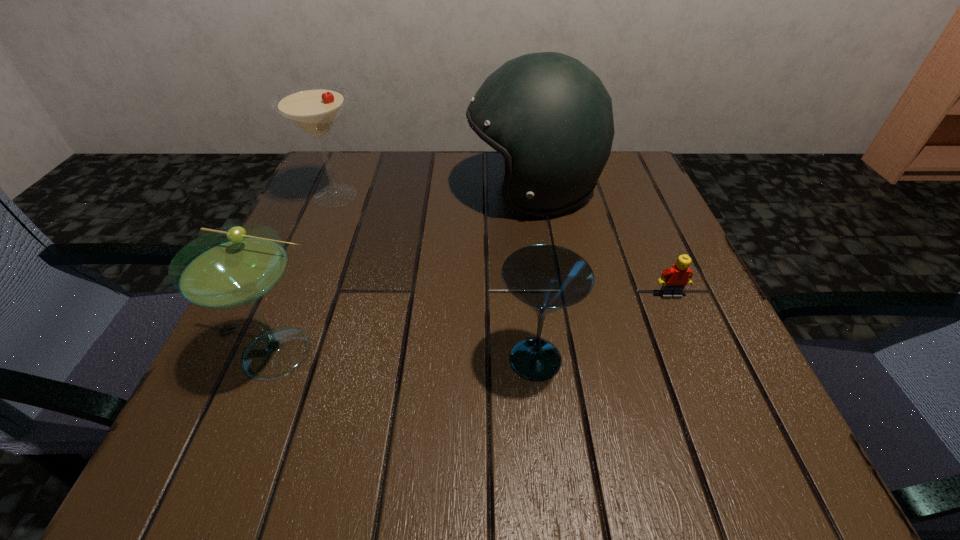
This screenshot has width=960, height=540. In order to click on free region at the left edge in this screenshot , I will do `click(279, 391)`.

You are a GUI agent. You are given a task and a screenshot of the screen. Output one action in this format:
    pyautogui.click(x=<x>, y=<y>)
    Task: Click on the vacant space at the right edge of the desktop
    The height and width of the screenshot is (540, 960).
    Given the screenshot: What is the action you would take?
    pyautogui.click(x=615, y=213)

Where is `vacant space at the far left corner of the desktop`? The height and width of the screenshot is (540, 960). vacant space at the far left corner of the desktop is located at coordinates point(382,158).

Locate an element on the screen. Image resolution: width=960 pixels, height=540 pixels. free space at the far right corner is located at coordinates (599, 206).

Image resolution: width=960 pixels, height=540 pixels. Identify the location of vacant area that lies between the shortest object and the farthest martini. (503, 246).

Locate an element on the screen. The width and height of the screenshot is (960, 540). vacant space that is in between the farthest martini and the football helmet is located at coordinates (435, 193).

Find the location of `object that is the second nearest to the farthest martini`. object that is the second nearest to the farthest martini is located at coordinates (234, 266).

Identify which object is the second nearest to the tallest object. Please provide its 2D coordinates. Your answer should be formatted as a tuple, i.e. [(x, y)], where the tuple contains the x and y coordinates of a point satisfying the conditions above.

[(314, 109)]

Where is `martini that is the second closest one to the rightmost martini`? This screenshot has height=540, width=960. martini that is the second closest one to the rightmost martini is located at coordinates (314, 109).

The width and height of the screenshot is (960, 540). I want to click on martini that is the nearest to the tallest object, so click(x=314, y=109).